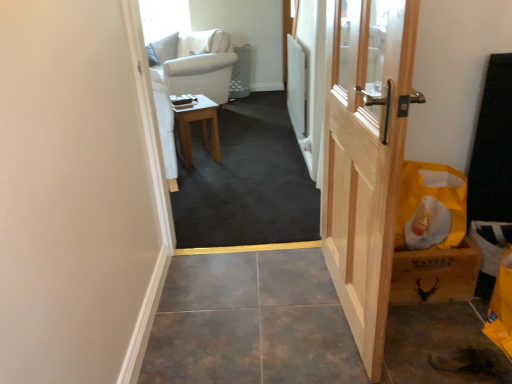
Find the location of `vacant space in natural wood door at right (from a real-world perspective)`. vacant space in natural wood door at right (from a real-world perspective) is located at coordinates (338, 307).